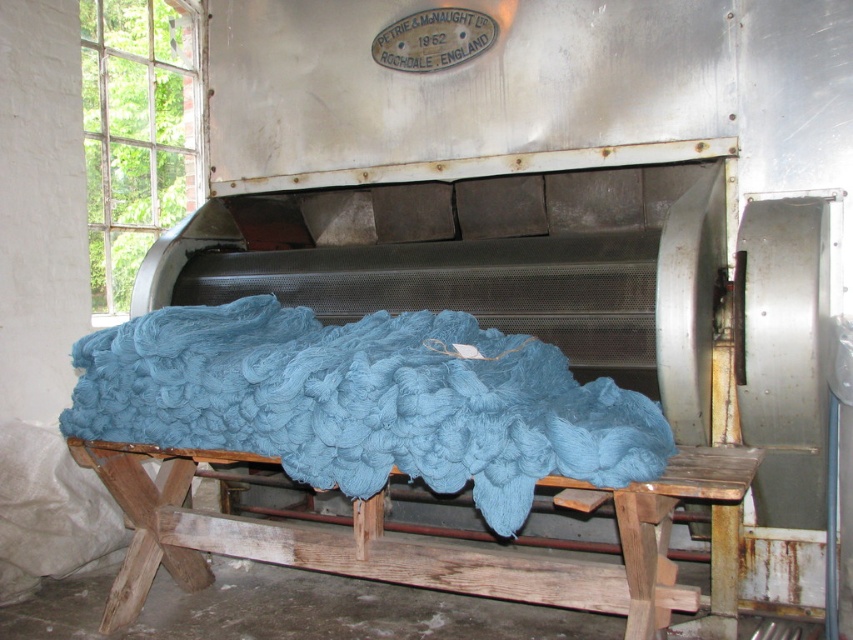
Which is more to the left, teal woolen blanket at center or wooden stool at center?

Positioned to the left is teal woolen blanket at center.

Who is shorter, teal woolen blanket at center or wooden stool at center?

With less height is teal woolen blanket at center.

What do you see at coordinates (364, 401) in the screenshot?
I see `teal woolen blanket at center` at bounding box center [364, 401].

The height and width of the screenshot is (640, 853). What are the coordinates of `teal woolen blanket at center` in the screenshot? It's located at (364, 401).